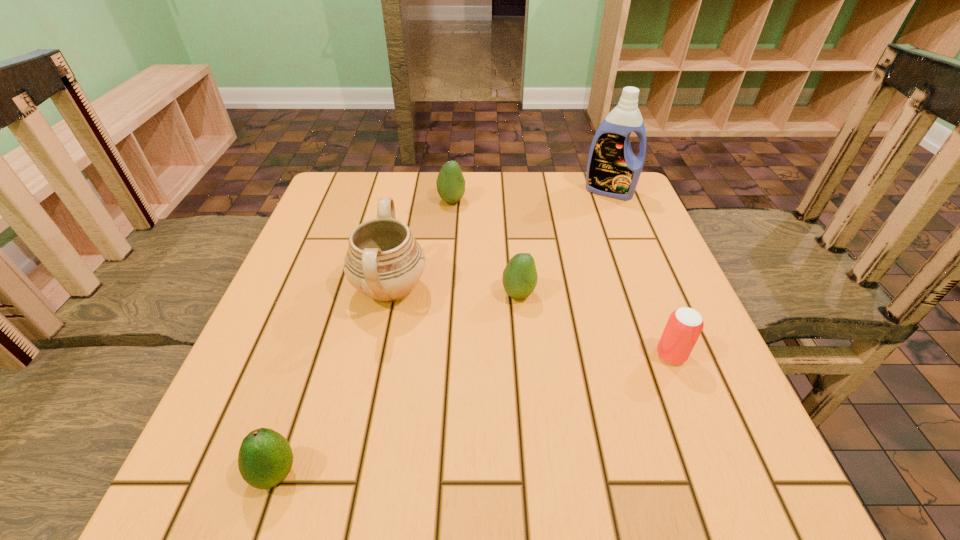
Locate which object is the fourth closest to the urn. Please provide its 2D coordinates. Your answer should be formatted as a tuple, i.e. [(x, y)], where the tuple contains the x and y coordinates of a point satisfying the conditions above.

[(684, 326)]

Find the location of a particular element. This screenshot has height=540, width=960. object identified as the fifth closest to the tallest object is located at coordinates (265, 458).

Where is `avocado object that ranks as the third closest to the tallest object`? The image size is (960, 540). avocado object that ranks as the third closest to the tallest object is located at coordinates (265, 458).

I want to click on avocado that is the second closest to the farthest avocado, so click(265, 458).

What are the coordinates of `vacant space that satisfies the following two spatial constraints: 1. on the back side of the nearest avocado; 2. on the left side of the second nearest avocado` in the screenshot? It's located at click(336, 294).

What are the coordinates of `free region that satisfies the following two spatial constraints: 1. on the front-facing side of the fifth shortest object; 2. on the back side of the second farthest avocado` in the screenshot? It's located at (389, 294).

Locate an element on the screen. Image resolution: width=960 pixels, height=540 pixels. free space that satisfies the following two spatial constraints: 1. on the front side of the second avocado from right to left; 2. on the front-facing side of the second tallest object is located at coordinates (444, 289).

Find the location of a particular element. Image resolution: width=960 pixels, height=540 pixels. vacant space that satisfies the following two spatial constraints: 1. on the front side of the fifth farthest object; 2. on the left side of the second avocado from right to left is located at coordinates (439, 355).